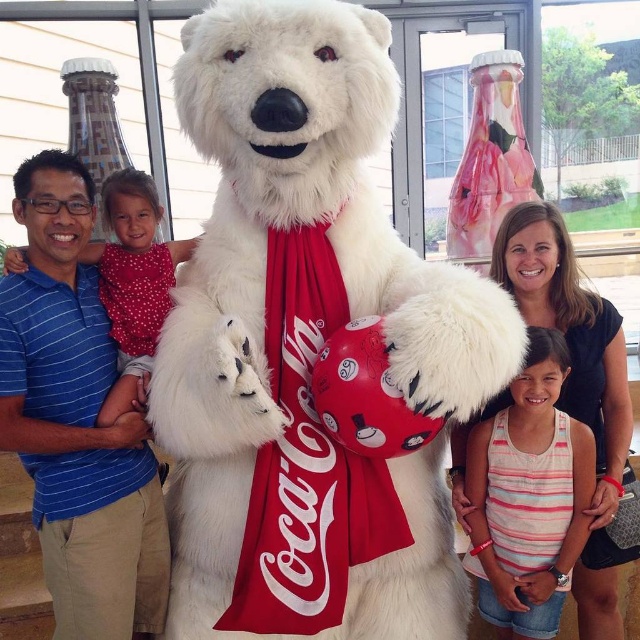
Who is positioned more to the right, white plush teddy bear at center or striped tank top at center?

Positioned to the right is striped tank top at center.

Can you confirm if white plush teddy bear at center is thinner than striped tank top at center?

No.

What are the coordinates of `white plush teddy bear at center` in the screenshot? It's located at (308, 344).

Between striped tank top at center and white fluffy bear at upper left, which one has less height?

white fluffy bear at upper left is shorter.

Is striped tank top at center thinner than white fluffy bear at upper left?

In fact, striped tank top at center might be wider than white fluffy bear at upper left.

Who is more forward, (502, 497) or (148, 198)?

Point (502, 497) is more forward.

The width and height of the screenshot is (640, 640). Find the location of `striped tank top at center`. striped tank top at center is located at coordinates click(529, 497).

Is white plush teddy bear at center shorter than white fluffy bear at upper left?

No, white plush teddy bear at center is not shorter than white fluffy bear at upper left.

Is point (397, 246) positioned in front of point (115, 332)?

No, (397, 246) is further to viewer.

I want to click on white plush teddy bear at center, so click(x=308, y=344).